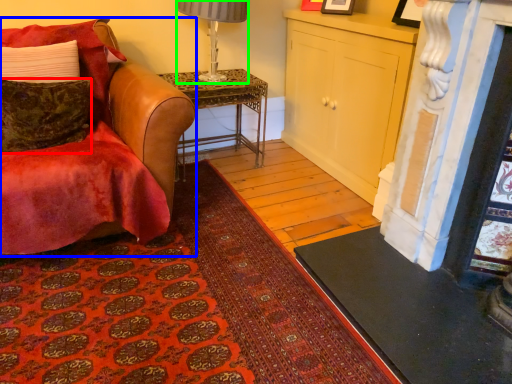
Question: Which object is the closest to the pillow (highlighted by a red box)? Choose among these: chair (highlighted by a blue box) or lamp (highlighted by a green box).

Choices:
 (A) chair
 (B) lamp

Answer: (A)